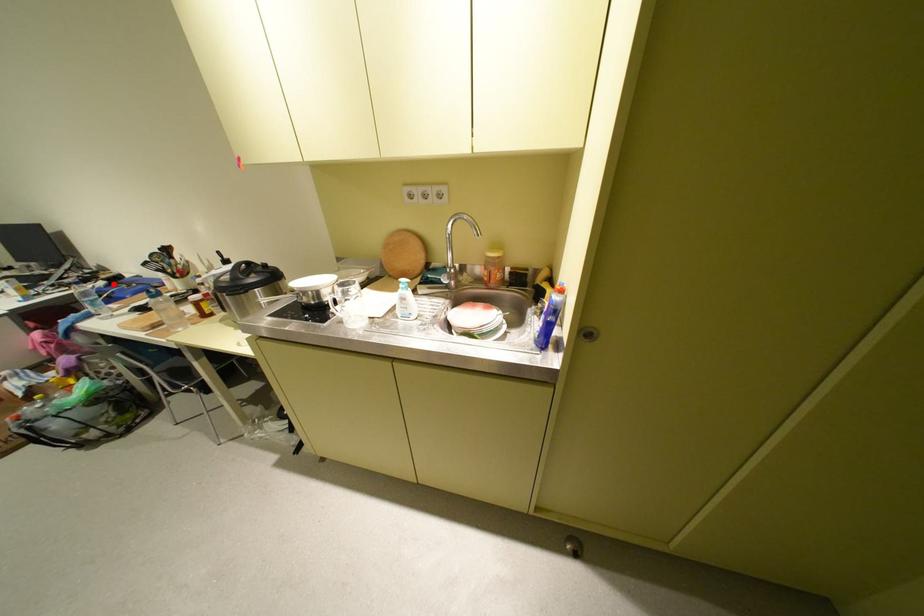
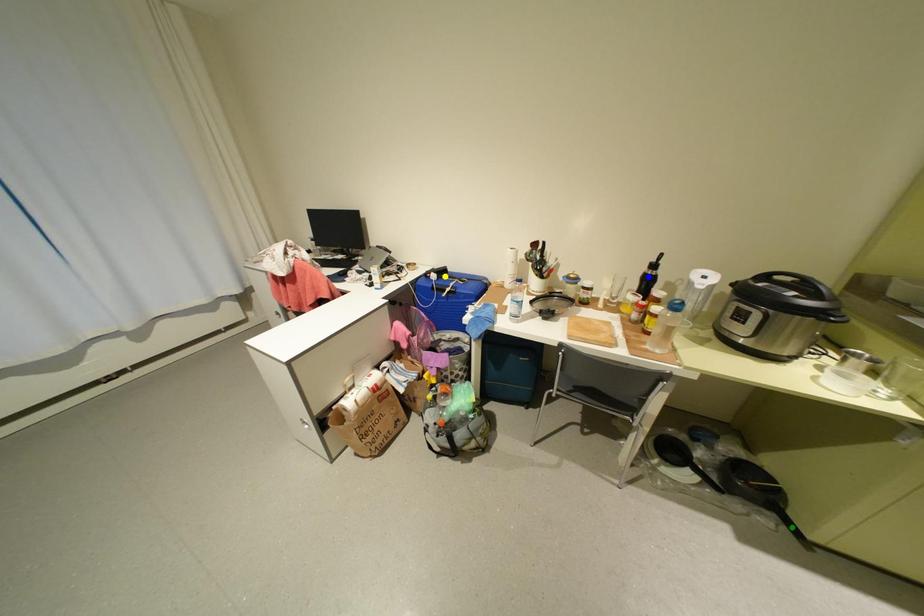
Question: I am providing you with two images of the same scene from different viewpoints. A red point is marked on the first image. You are given multiple points on the second image. Which spot in image 2 lines up with the point in image 1?

Choices:
 (A) yellow point
 (B) blue point
 (C) green point

Answer: (A)